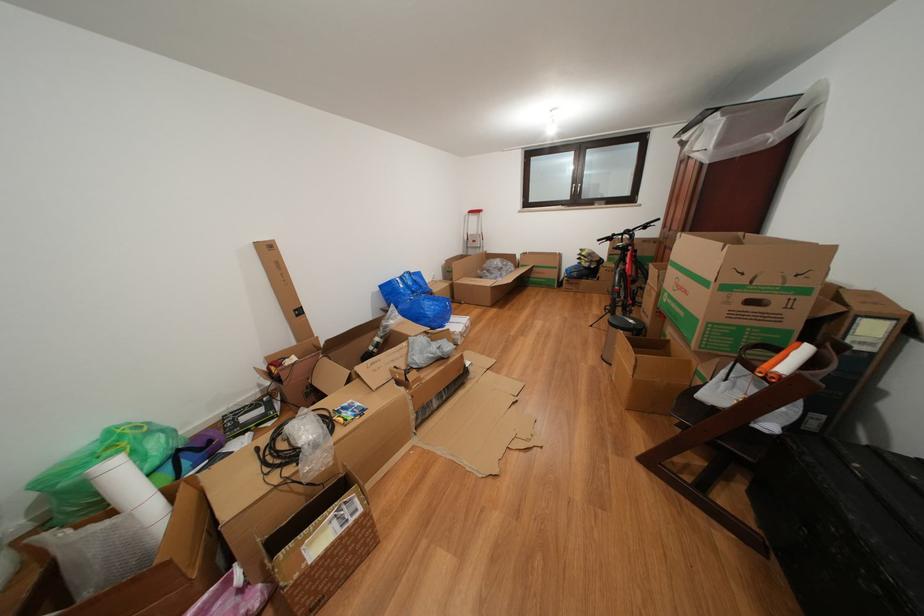
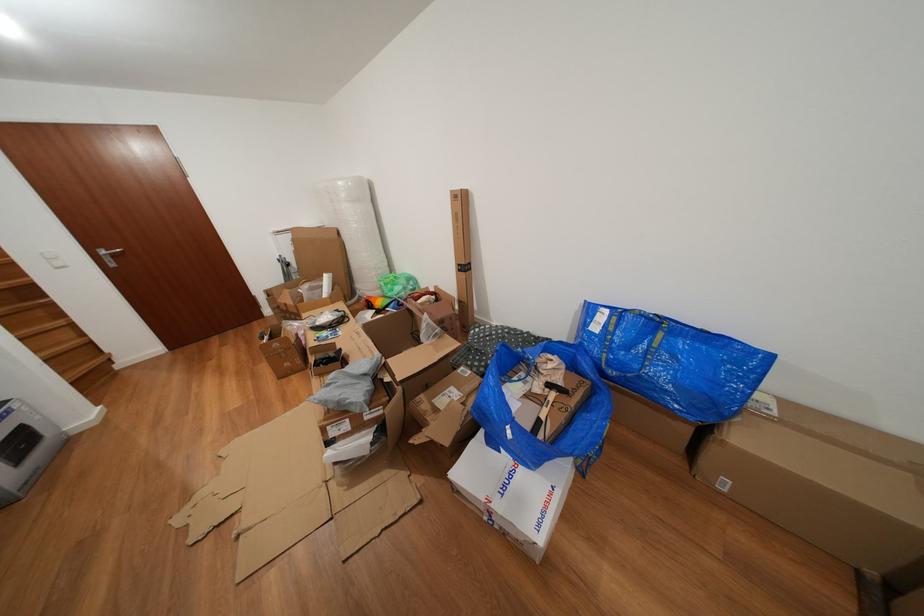
Where in the second image is the point corresponding to pixel 306 321 from the first image?

(468, 276)